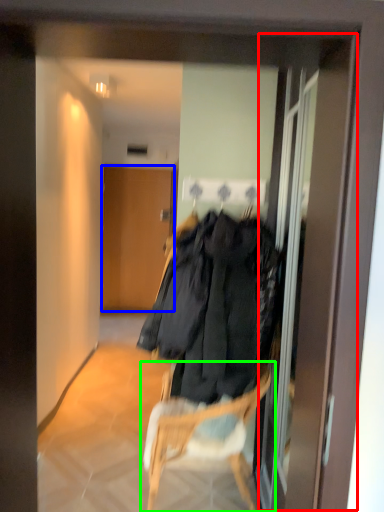
Question: Which object is positioned farthest from screen door (highlighted by a red box)? Select from door (highlighted by a blue box) and chair (highlighted by a green box).

Choices:
 (A) door
 (B) chair

Answer: (A)